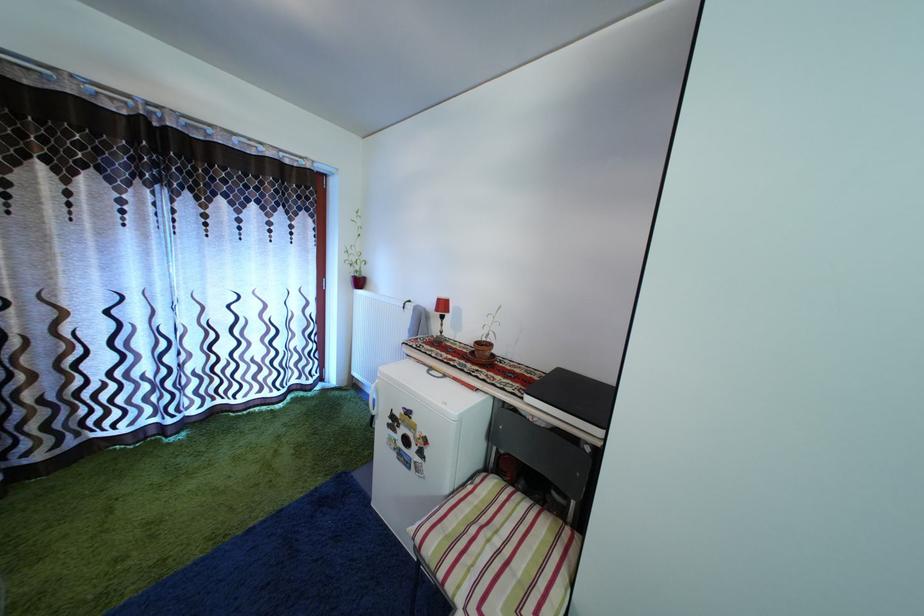
The width and height of the screenshot is (924, 616). What are the coordinates of `striped chair sitting surface` in the screenshot? It's located at (504, 554).